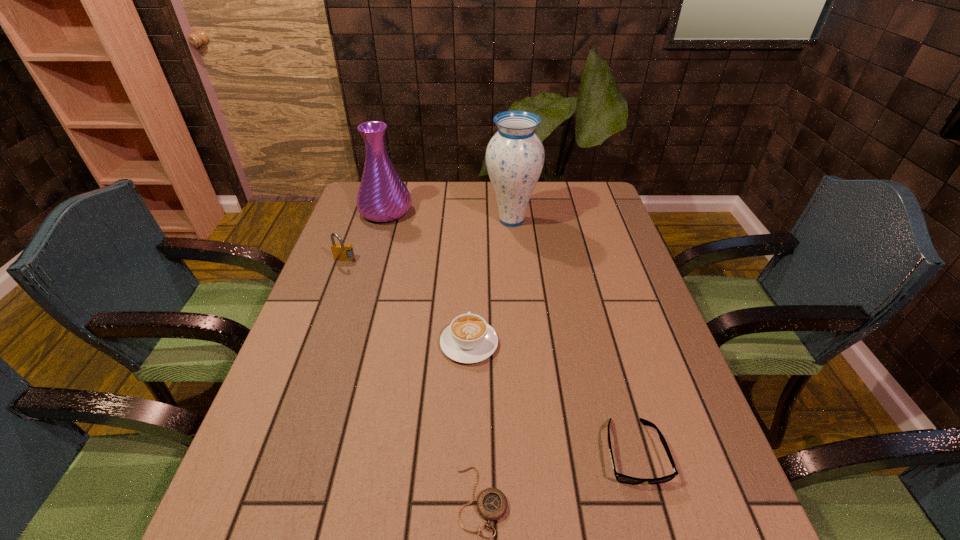
Locate an element on the screen. Image resolution: width=960 pixels, height=540 pixels. vacant point located between the padlock and the left vase is located at coordinates (365, 236).

At what (x,y) coordinates should I click in order to perform the action: click on free space between the pocket watch and the second shortest object. Please return your answer as a coordinate pair (x, y). This screenshot has height=540, width=960. Looking at the image, I should click on (558, 477).

You are a GUI agent. You are given a task and a screenshot of the screen. Output one action in this format:
    pyautogui.click(x=<x>, y=<y>)
    Task: Click on the free point between the shortest object and the rightmost object
    The image size is (960, 540).
    Given the screenshot: What is the action you would take?
    pyautogui.click(x=558, y=477)

Locate an element on the screen. vacant space that's between the right vase and the rightmost object is located at coordinates coord(573,336).

Identify the location of the fourth closest object relative to the pocket watch. (515, 155).

Where is `object that ranks as the third closest to the right vase`? object that ranks as the third closest to the right vase is located at coordinates (341, 252).

I want to click on free point that satisfies the following two spatial constraints: 1. on the side of the right vase with the handle; 2. on the right side of the third shortest object, so click(472, 220).

Identify the location of vacant position in the image that satisfies the following two spatial constraints: 1. on the back side of the shortest object; 2. on the right side of the right vase. This screenshot has width=960, height=540. (481, 220).